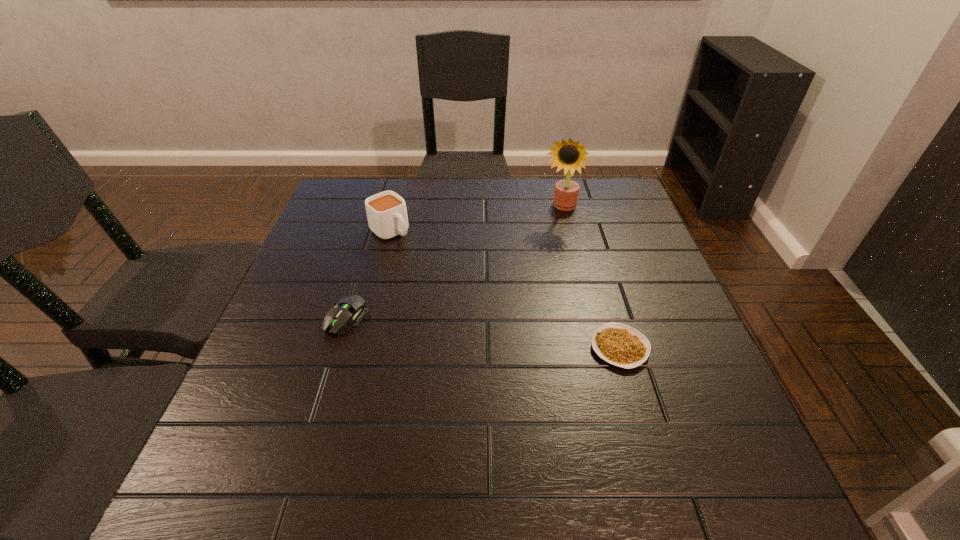
The height and width of the screenshot is (540, 960). In order to click on free space on the desktop that is between the third tallest object and the shortest object and is positioned on the side with the handle of the third shortest object in this screenshot , I will do click(511, 336).

Find the location of a particular element. The height and width of the screenshot is (540, 960). vacant space on the desktop that is between the third tallest object and the shortest object and is positioned on the face of the sunflower is located at coordinates (499, 335).